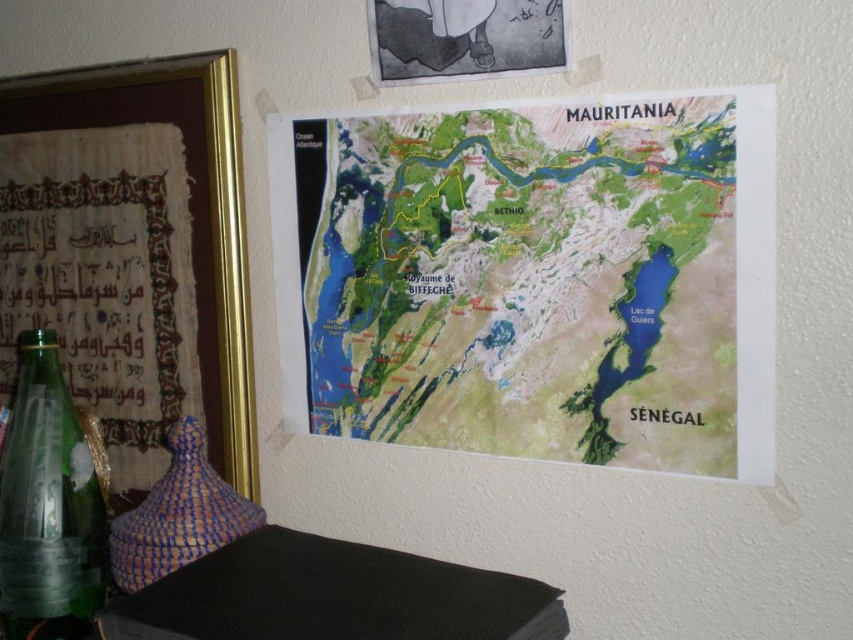
Consider the image. You are an interior designer assessing wall spacing. You see the green paper map at upper center and the transparent glass bottle at lower left. Which object has a greater width?

The green paper map at upper center has a greater width than the transparent glass bottle at lower left.